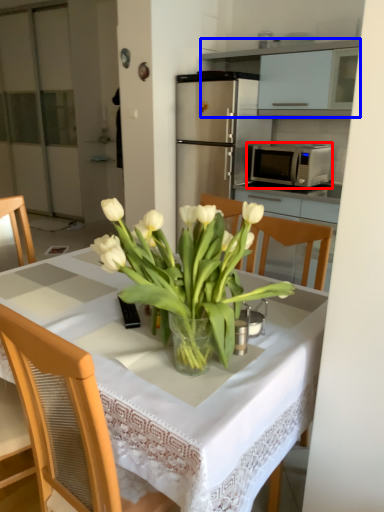
Question: Among these objects, which one is farthest to the camera, microwave oven (highlighted by a red box) or cabinetry (highlighted by a blue box)?

Choices:
 (A) microwave oven
 (B) cabinetry

Answer: (A)